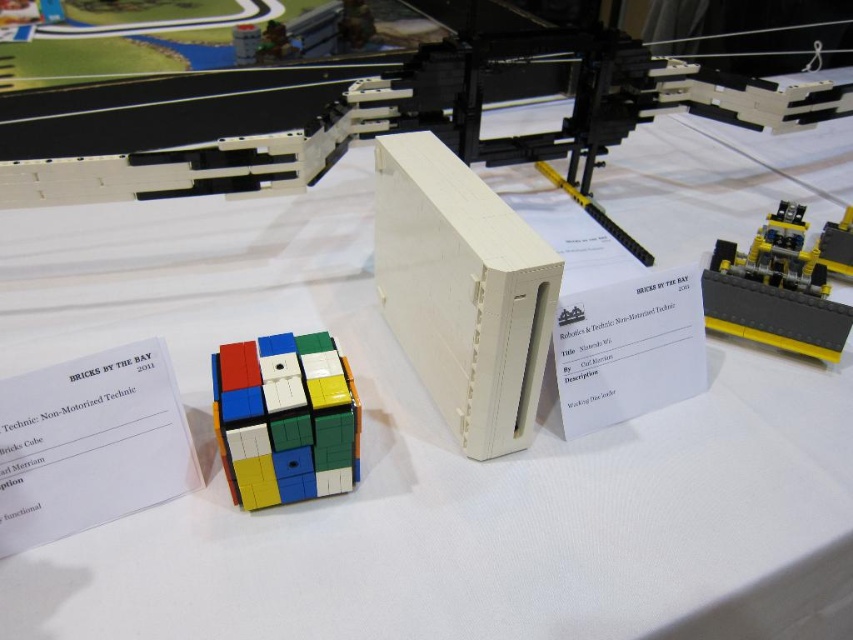
Question: Which point is farther to the camera?

Choices:
 (A) yellow plastic motor at upper right
 (B) multicolored plastic rubik's cube at center

Answer: (A)

Question: Which point is closer to the camera?

Choices:
 (A) multicolored plastic rubik's cube at center
 (B) white matte rectangular block at center

Answer: (A)

Question: Does multicolored plastic rubik's cube at center appear on the right side of yellow plastic motor at upper right?

Choices:
 (A) no
 (B) yes

Answer: (A)

Question: Which object appears closest to the camera in this image?

Choices:
 (A) multicolored plastic rubik's cube at center
 (B) white matte rectangular block at center
 (C) yellow plastic motor at upper right

Answer: (A)

Question: Can you confirm if white matte rectangular block at center is bigger than multicolored plastic rubik's cube at center?

Choices:
 (A) no
 (B) yes

Answer: (B)

Question: Is multicolored plastic rubik's cube at center positioned at the back of yellow plastic motor at upper right?

Choices:
 (A) yes
 (B) no

Answer: (B)